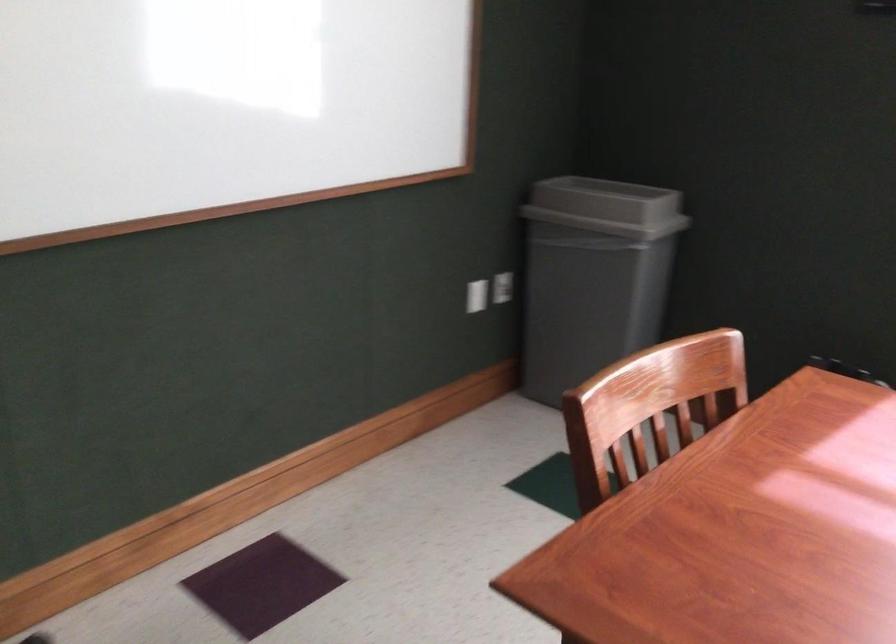
This screenshot has width=896, height=644. I want to click on trash can lid, so click(607, 207).